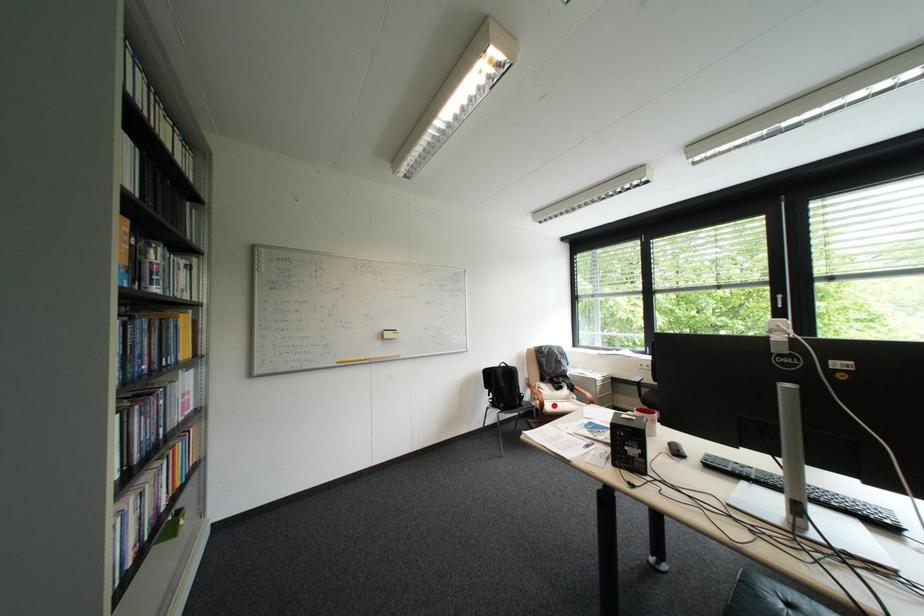
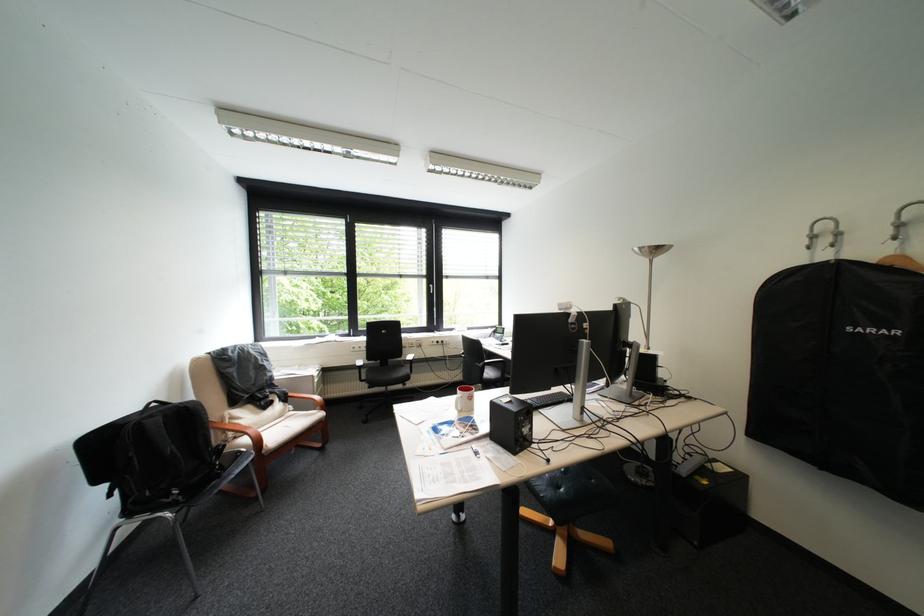
Question: A red point is marked in image1. In image2, is the corresponding 3D point closer to the camera or farther? Reply with the corresponding letter.

Choices:
 (A) The corresponding 3D point is closer.
 (B) The corresponding 3D point is farther.

Answer: (A)